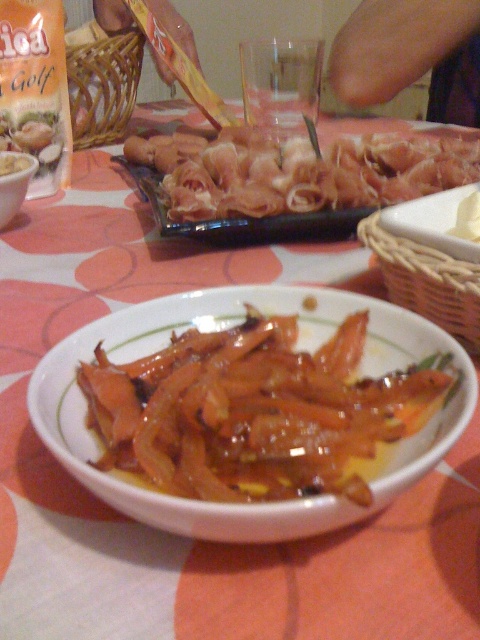
Question: Among these objects, which one is farthest from the camera?

Choices:
 (A) glossy glazed carrots at center
 (B) pinkish glossy meat at center
 (C) matte white bowl at upper left

Answer: (C)

Question: Estimate the real-world distances between objects in this image. Which object is farther from the matte white bowl at upper left?

Choices:
 (A) glossy glazed carrots at center
 (B) pinkish glossy meat at center

Answer: (A)

Question: Does pinkish glossy meat at center have a smaller size compared to matte white bowl at upper left?

Choices:
 (A) yes
 (B) no

Answer: (B)

Question: Can you confirm if pinkish glossy meat at center is wider than matte white bowl at upper left?

Choices:
 (A) no
 (B) yes

Answer: (B)

Question: Which point is farther to the camera?

Choices:
 (A) matte white bowl at upper left
 (B) pinkish glossy meat at center
 (C) glossy glazed carrots at center

Answer: (A)

Question: Observing the image, what is the correct spatial positioning of glossy glazed carrots at center in reference to pinkish glossy meat at center?

Choices:
 (A) above
 (B) below

Answer: (B)